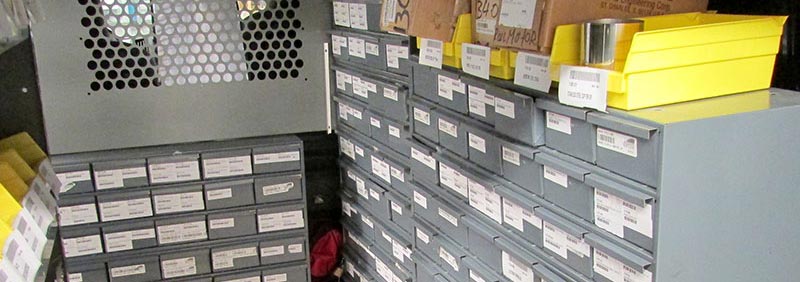
You are a GUI agent. You are given a task and a screenshot of the screen. Output one action in this format:
    pyautogui.click(x=<x>, y=<y>)
    Task: Click on the cardboard boxes
    
    Given the screenshot: What is the action you would take?
    pyautogui.click(x=418, y=11), pyautogui.click(x=477, y=16), pyautogui.click(x=534, y=35)